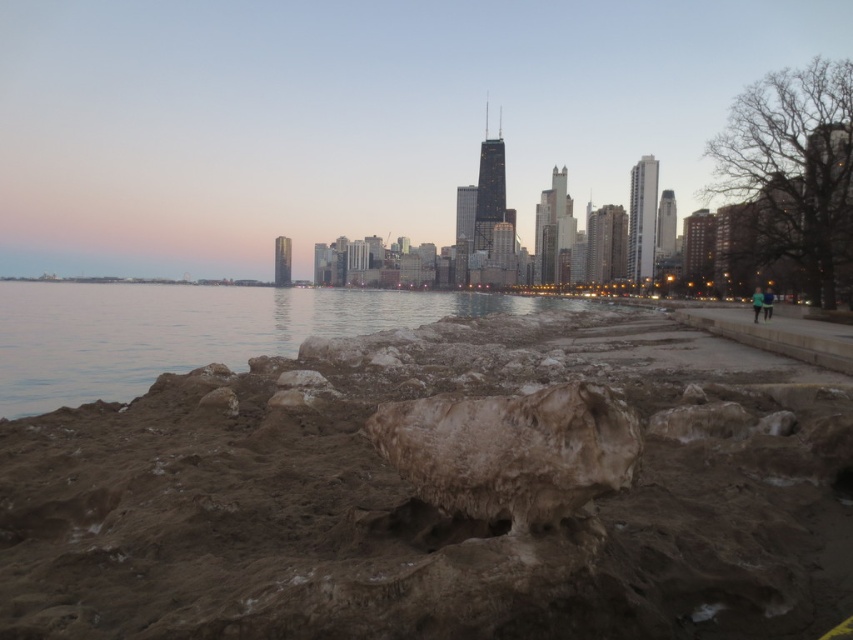
Question: Which of the following is the closest to the observer?

Choices:
 (A) (410, 440)
 (B) (129, 369)
 (C) (206, 397)
 (D) (670, 568)

Answer: (A)

Question: Does clear water at lower left appear on the left side of smooth brown rock at lower left?

Choices:
 (A) no
 (B) yes

Answer: (B)

Question: Does brown muddy rock at lower center appear on the left side of smooth brown rock at lower left?

Choices:
 (A) no
 (B) yes

Answer: (A)

Question: Which object appears closest to the camera in this image?

Choices:
 (A) smooth brown rock at lower left
 (B) brown rough stone at center
 (C) clear water at lower left

Answer: (B)

Question: Does brown muddy rock at lower center have a lesser width compared to clear water at lower left?

Choices:
 (A) yes
 (B) no

Answer: (A)

Question: Which point appears farthest from the camera in this image?

Choices:
 (A) (224, 390)
 (B) (851, 474)
 (C) (399, 426)

Answer: (A)